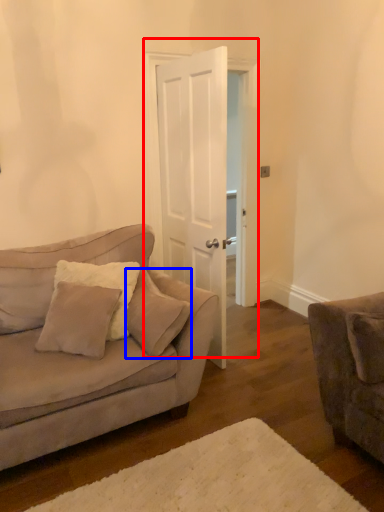
Question: Which of the following is the closest to the observer, door (highlighted by a red box) or pillow (highlighted by a blue box)?

Choices:
 (A) door
 (B) pillow

Answer: (B)